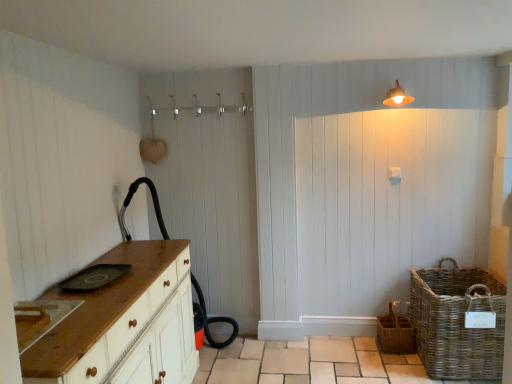
At what (x,y) coordinates should I click in order to perform the action: click on blank space situated above wooden chest of drawers at left (from a real-world perspective). Please return your answer as a coordinate pair (x, y). This screenshot has width=512, height=384. Looking at the image, I should click on (94, 279).